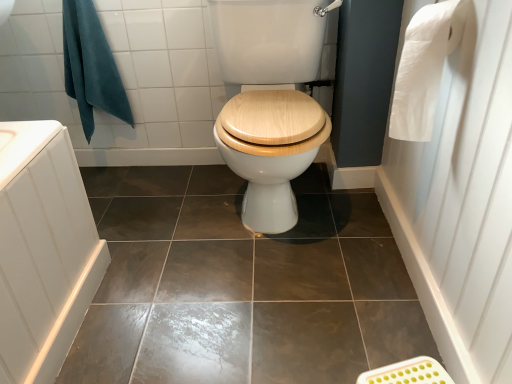
Question: Can you confirm if teal fabric towel at upper left is positioned to the right of brown glossy tile at center?

Choices:
 (A) no
 (B) yes

Answer: (A)

Question: Does teal fabric towel at upper left have a greater width compared to brown glossy tile at center?

Choices:
 (A) no
 (B) yes

Answer: (A)

Question: Is there a large distance between teal fabric towel at upper left and brown glossy tile at center?

Choices:
 (A) yes
 (B) no

Answer: (B)

Question: Is teal fabric towel at upper left placed right next to brown glossy tile at center?

Choices:
 (A) yes
 (B) no

Answer: (B)

Question: From a real-world perspective, is teal fabric towel at upper left over brown glossy tile at center?

Choices:
 (A) no
 (B) yes

Answer: (B)

Question: Is brown glossy tile at center taller or shorter than white paper at upper right?

Choices:
 (A) short
 (B) tall

Answer: (A)

Question: Relative to white paper at upper right, is brown glossy tile at center in front or behind?

Choices:
 (A) behind
 (B) front

Answer: (A)

Question: From a real-world perspective, relative to white paper at upper right, is brown glossy tile at center vertically above or below?

Choices:
 (A) above
 (B) below

Answer: (B)

Question: In the image, is brown glossy tile at center on the left side or the right side of white paper at upper right?

Choices:
 (A) right
 (B) left

Answer: (B)

Question: From the image's perspective, is brown glossy tile at center positioned above or below teal fabric towel at upper left?

Choices:
 (A) below
 (B) above

Answer: (A)

Question: Does point (355, 236) appear closer or farther from the camera than point (64, 1)?

Choices:
 (A) closer
 (B) farther

Answer: (A)

Question: In terms of width, does brown glossy tile at center look wider or thinner when compared to teal fabric towel at upper left?

Choices:
 (A) thin
 (B) wide

Answer: (B)

Question: Based on their positions, is brown glossy tile at center located to the left or right of teal fabric towel at upper left?

Choices:
 (A) right
 (B) left

Answer: (A)

Question: Is white paper at upper right in front of or behind teal fabric towel at upper left in the image?

Choices:
 (A) behind
 (B) front

Answer: (B)

Question: From a real-world perspective, is white paper at upper right above or below teal fabric towel at upper left?

Choices:
 (A) below
 (B) above

Answer: (B)